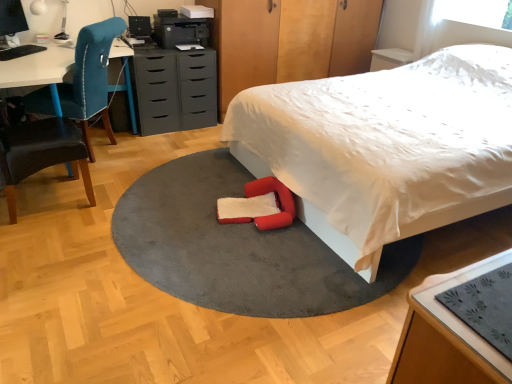
The image size is (512, 384). Identify the location of unoccupied space behind red plush bean bag chair at lower center. (x=223, y=180).